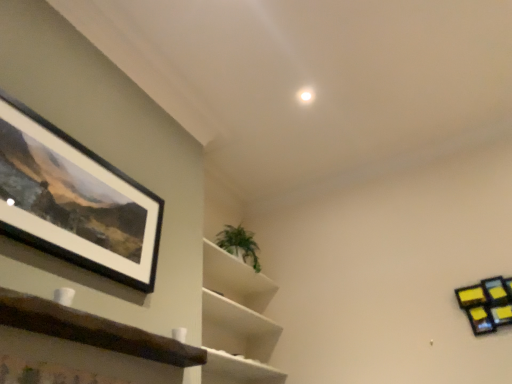
Question: Does point (92, 235) appear closer or farther from the camera than point (492, 297)?

Choices:
 (A) farther
 (B) closer

Answer: (B)

Question: From the image's perspective, relative to yellow sticky notes at upper right, the third shelf viewed from the left, is black matte picture frame at upper left above or below?

Choices:
 (A) below
 (B) above

Answer: (B)

Question: Estimate the real-world distances between objects in this image. Which object is farther from the yellow sticky notes at upper right, which is the 3th shelf in front-to-back order?

Choices:
 (A) green leafy plant at upper center
 (B) black matte picture frame at upper left
 (C) brown wooden shelf at lower left, the third shelf in the right-to-left sequence
 (D) green leafy plant at center, marked as the second shelf in a right-to-left arrangement

Answer: (B)

Question: Estimate the real-world distances between objects in this image. Which object is farther from the green leafy plant at center, the second shelf positioned from the left?

Choices:
 (A) yellow sticky notes at upper right, which is the 3th shelf in front-to-back order
 (B) black matte picture frame at upper left
 (C) brown wooden shelf at lower left, positioned as the 1th shelf in front-to-back order
 (D) green leafy plant at upper center

Answer: (A)